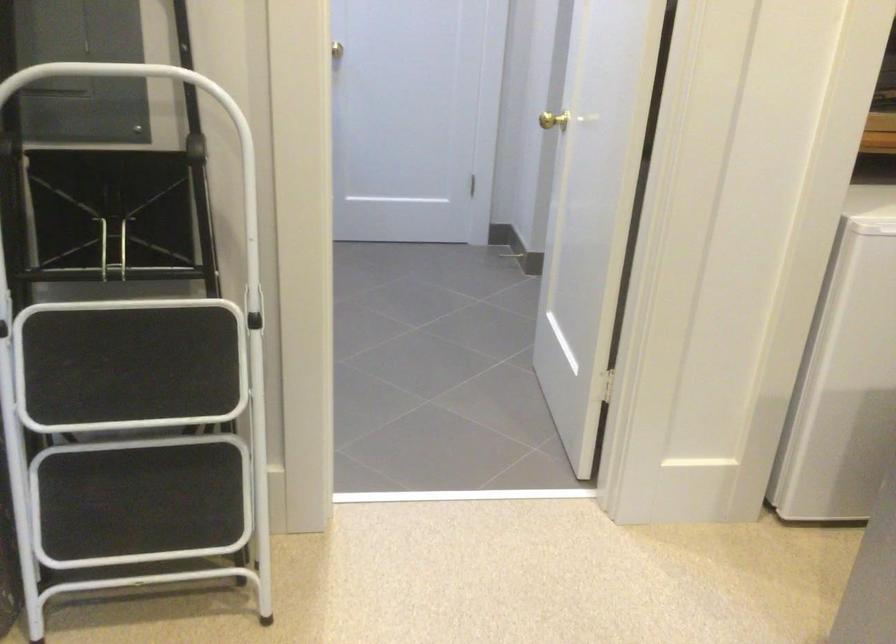
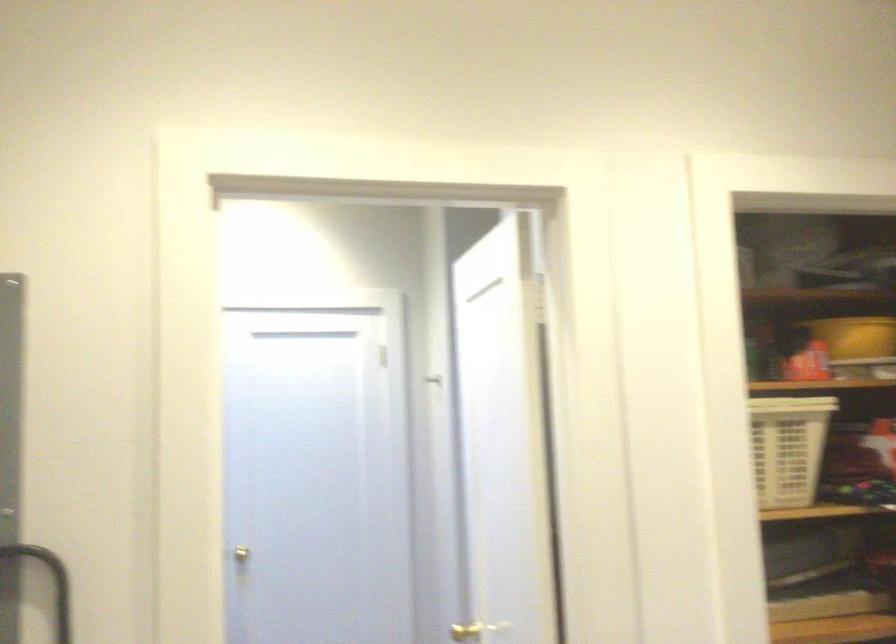
Find the pixel in the second image that matches (558,118) in the first image.

(464, 632)